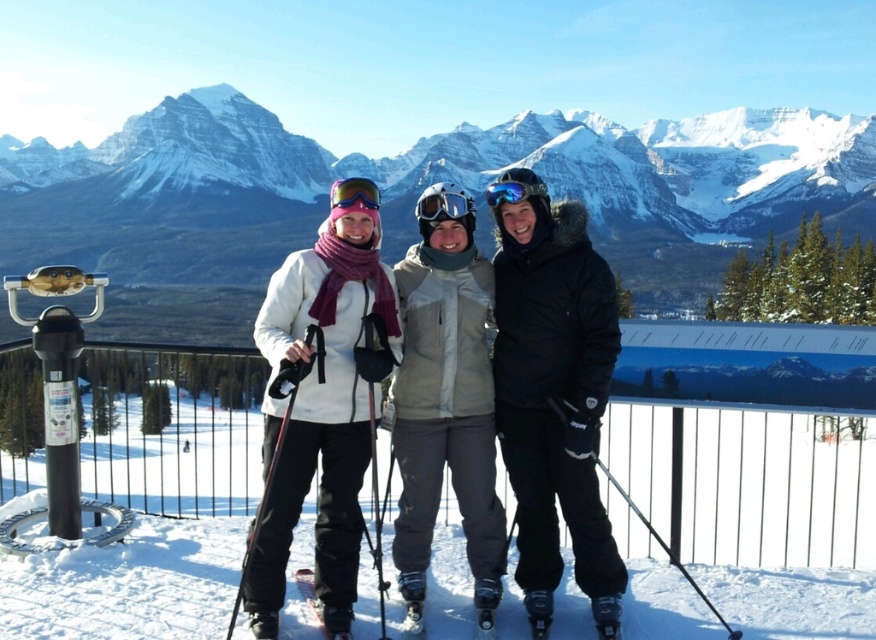
Can you confirm if transparent plastic goggles at center is smaller than matte blue goggles at center?

Indeed, transparent plastic goggles at center has a smaller size compared to matte blue goggles at center.

Is point (425, 202) positioned before point (364, 202)?

No, (425, 202) is behind (364, 202).

You are a GUI agent. You are given a task and a screenshot of the screen. Output one action in this format:
    pyautogui.click(x=<x>, y=<y>)
    Task: Click on the transparent plastic goggles at center
    This screenshot has width=876, height=640.
    Given the screenshot: What is the action you would take?
    pyautogui.click(x=443, y=202)

Is point (260, 548) more distant than point (564, 369)?

That is False.

Is point (373, 371) behind point (531, 240)?

No, it is in front of (531, 240).

Where is `white fleece jacket at center`? white fleece jacket at center is located at coordinates click(411, 378).

Is white fleece jacket at center positioned before matte blue goggles at center?

Yes, it is.

Can you confirm if white fleece jacket at center is bigger than matte blue goggles at center?

Actually, white fleece jacket at center might be smaller than matte blue goggles at center.

The width and height of the screenshot is (876, 640). Identify the location of white fleece jacket at center. (411, 378).